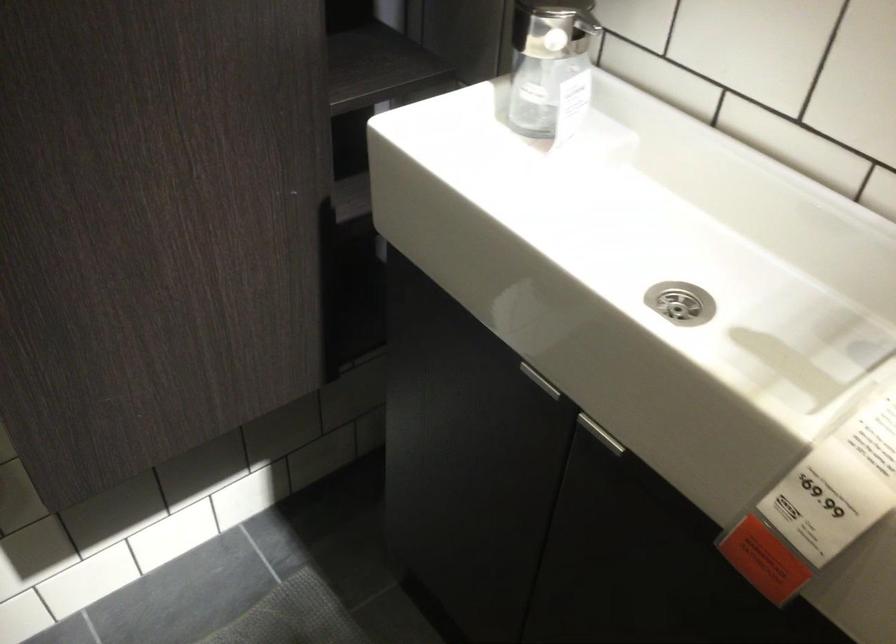
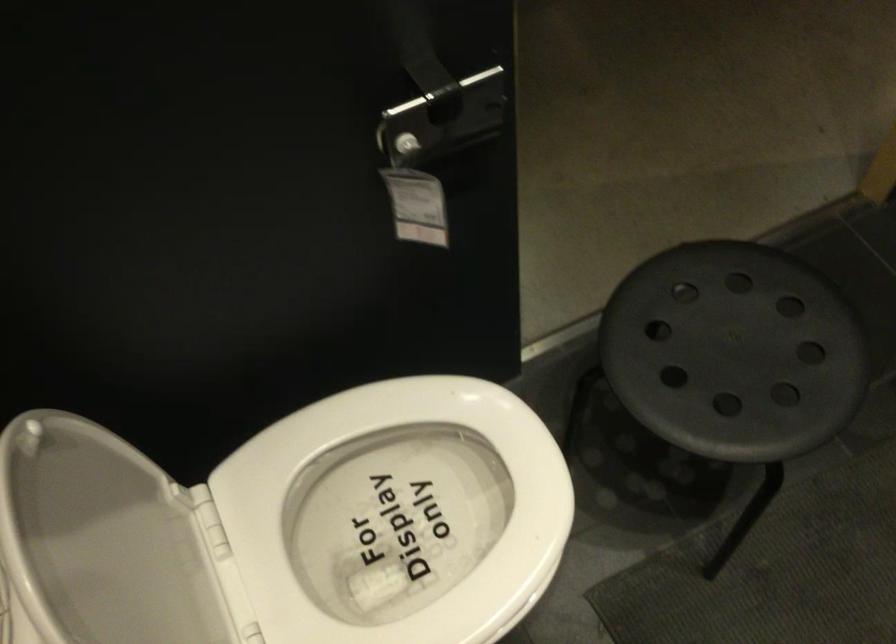
First-person continuous shooting, in which direction is the camera rotating?

The camera rotated toward left-down.